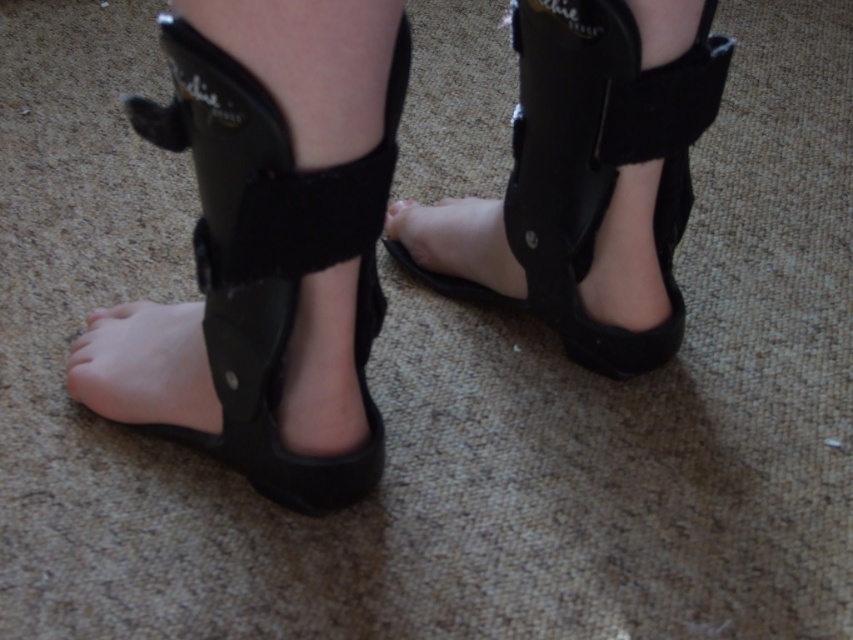
Question: Is black suede sandal at lower left wider than black suede ankle brace at lower left?

Choices:
 (A) no
 (B) yes

Answer: (B)

Question: Estimate the real-world distances between objects in this image. Which object is farther from the black suede foot at center?

Choices:
 (A) matte black toe at center
 (B) black suede sandal at center

Answer: (A)

Question: Which object is farther from the camera taking this photo?

Choices:
 (A) matte black toe at center
 (B) black suede foot at center
 (C) black suede sandal at center

Answer: (A)

Question: Observing the image, what is the correct spatial positioning of black suede ankle brace at lower left in reference to black suede foot at center?

Choices:
 (A) above
 (B) below

Answer: (B)

Question: Which point appears closest to the camera in this image?

Choices:
 (A) pyautogui.click(x=409, y=204)
 (B) pyautogui.click(x=207, y=44)
 (C) pyautogui.click(x=491, y=301)
 (D) pyautogui.click(x=610, y=360)

Answer: (B)

Question: Is the position of black suede sandal at lower left more distant than that of black suede ankle brace at lower left?

Choices:
 (A) no
 (B) yes

Answer: (A)